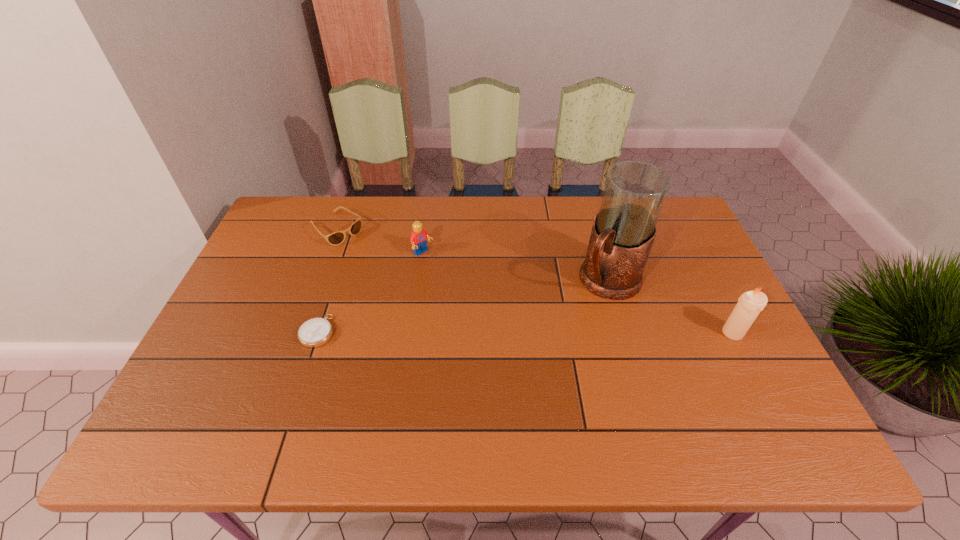
The height and width of the screenshot is (540, 960). Identify the location of object that is at the left edge. (336, 238).

The height and width of the screenshot is (540, 960). I want to click on object that is at the right edge, so click(x=751, y=303).

Find the location of a particular element. The width and height of the screenshot is (960, 540). object that is at the far left corner is located at coordinates click(x=336, y=238).

This screenshot has width=960, height=540. Identify the location of vacant space at the far edge. (402, 211).

The image size is (960, 540). In order to click on vacant space at the near edge of the desktop in this screenshot , I will do `click(531, 387)`.

You are a GUI agent. You are given a task and a screenshot of the screen. Output one action in this format:
    pyautogui.click(x=<x>, y=<y>)
    Task: Click on the vacant space at the left edge
    The image size is (960, 540).
    Given the screenshot: What is the action you would take?
    pyautogui.click(x=301, y=254)

Identify the location of free spot at the right edge of the desktop. tap(676, 308).

Identify the location of blank space at the far right corner. (673, 223).

The image size is (960, 540). In order to click on vacant space at the near right corner in this screenshot , I will do `click(768, 407)`.

Where is `vacant space that is in between the third shortest object and the candle`? Image resolution: width=960 pixels, height=540 pixels. vacant space that is in between the third shortest object and the candle is located at coordinates (578, 293).